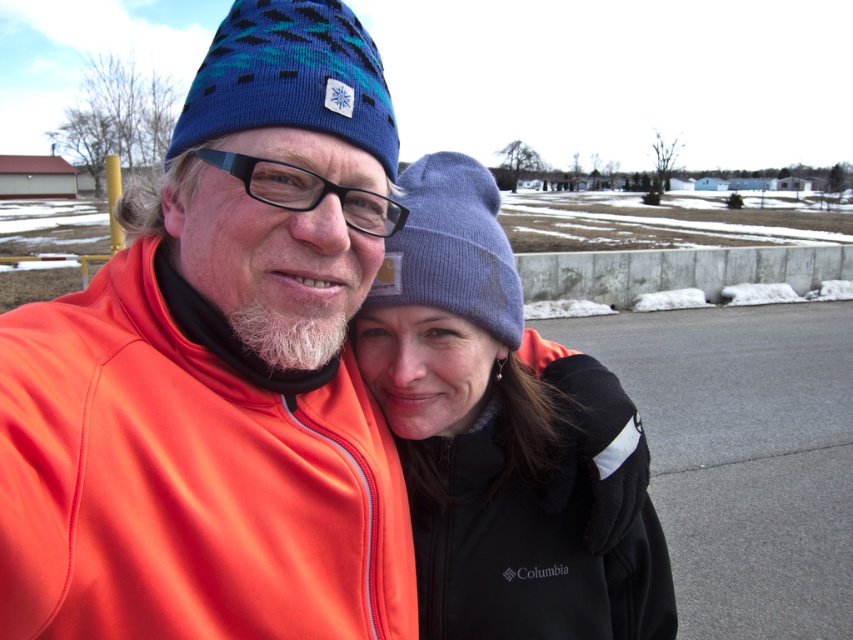
Between matte orange jacket at center and lavender knit beanie at center, which one is positioned lower?

Positioned lower is matte orange jacket at center.

Who is positioned more to the right, matte orange jacket at center or lavender knit beanie at center?

Positioned to the right is lavender knit beanie at center.

Is point (267, 189) farther from camera compared to point (407, 193)?

That is False.

The image size is (853, 640). I want to click on matte orange jacket at center, so click(x=219, y=372).

Is point (469, 451) closer to camera compared to point (218, 61)?

No, it is not.

Can you confirm if black fleece jacket at center is positioned to the left of blue knitted beanie at upper center?

In fact, black fleece jacket at center is to the right of blue knitted beanie at upper center.

Who is more distant from viewer, (590, 452) or (218, 64)?

The point (590, 452) is behind.

This screenshot has height=640, width=853. Identify the location of black fleece jacket at center. (503, 436).

Describe the element at coordinates (289, 77) in the screenshot. I see `blue knitted beanie at upper center` at that location.

Image resolution: width=853 pixels, height=640 pixels. Describe the element at coordinates (289, 77) in the screenshot. I see `blue knitted beanie at upper center` at that location.

The width and height of the screenshot is (853, 640). I want to click on blue knitted beanie at upper center, so click(289, 77).